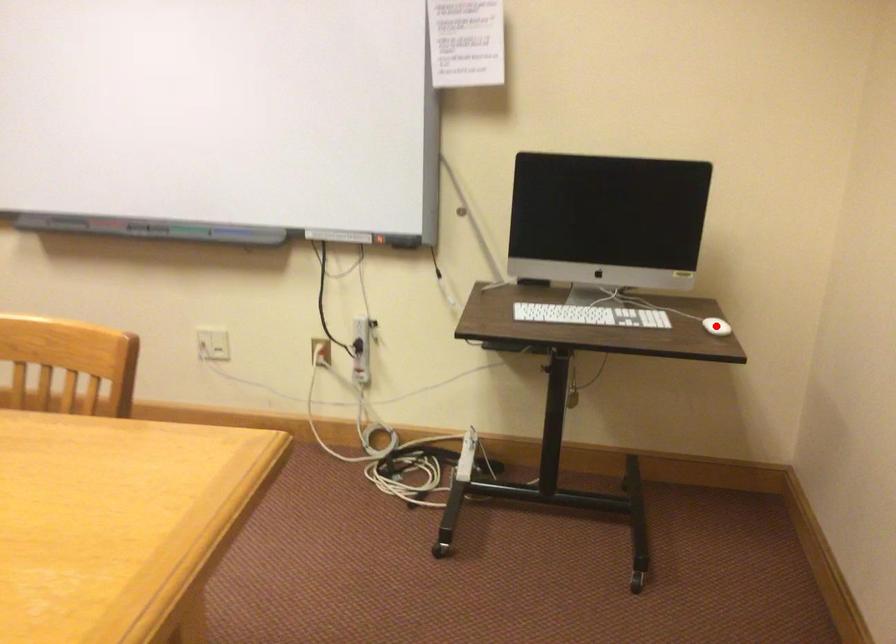
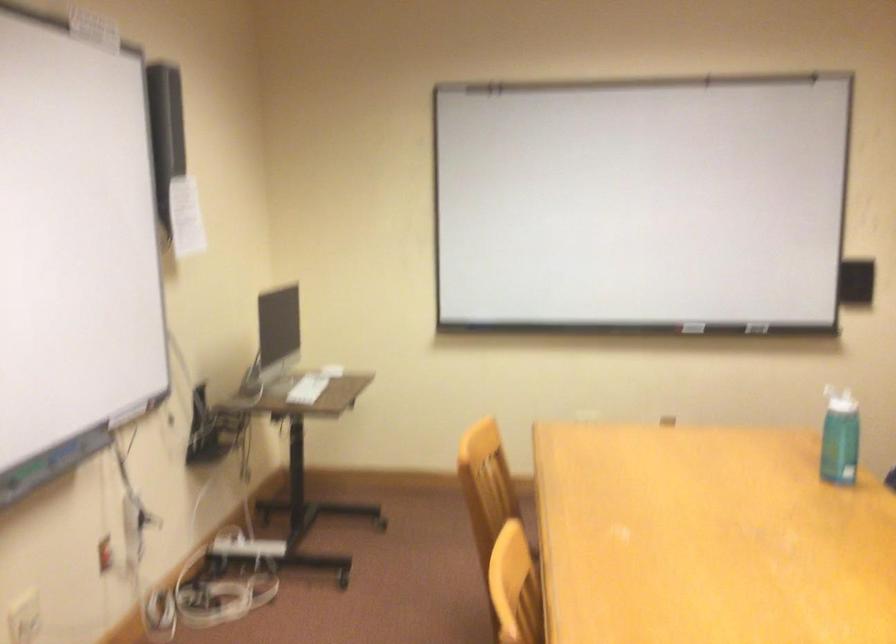
Question: I am providing you with two images of the same scene from different viewpoints. A red point is marked on the first image. At the location where the point appears in image 1, is it still visible in image 2?

Choices:
 (A) Yes
 (B) No

Answer: (B)